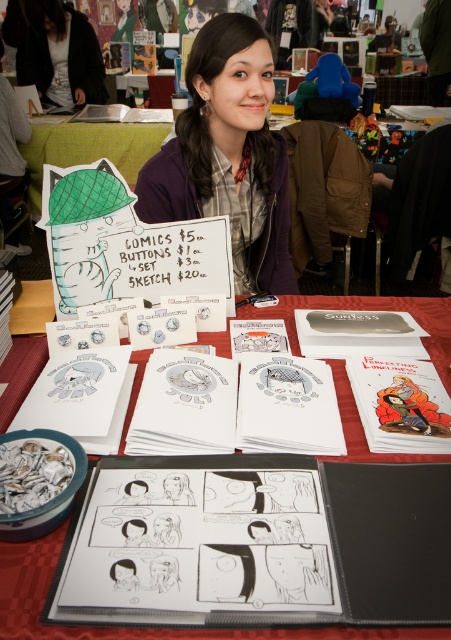
Is point (123, 444) more distant than point (115, 564)?

Yes, point (123, 444) is behind point (115, 564).

Can you confirm if white paper comic book at center is thinner than black ink drawing of a person at center?

No.

Does point (50, 634) come in front of point (118, 580)?

Yes, point (50, 634) is in front of point (118, 580).

Locate an element on the screen. The image size is (451, 640). white paper comic book at center is located at coordinates (130, 627).

Who is more distant from viewer, (230, 140) or (138, 534)?

Point (230, 140)

Can you confirm if matte purple sweater at center is positioned to the left of black paper at center?

Incorrect, matte purple sweater at center is not on the left side of black paper at center.

Locate an element on the screen. The height and width of the screenshot is (640, 451). matte purple sweater at center is located at coordinates (228, 154).

Is matte purple sweater at center smaller than white paper comic book at center?

Yes, matte purple sweater at center is smaller than white paper comic book at center.

Is point (145, 180) closer to viewer compared to point (46, 580)?

No, (145, 180) is further to viewer.

In order to click on matte purple sweater at center in this screenshot , I will do `click(228, 154)`.